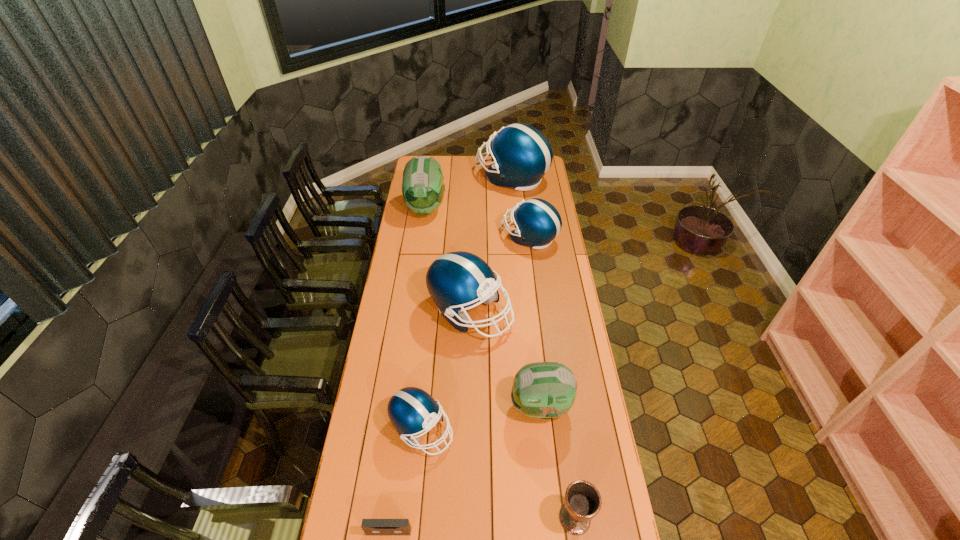
Locate an element on the screen. The image size is (960, 540). the tallest object is located at coordinates (521, 155).

Image resolution: width=960 pixels, height=540 pixels. Find the location of `the tallest football helmet`. the tallest football helmet is located at coordinates (521, 155).

This screenshot has height=540, width=960. In order to click on the farther green football helmet in this screenshot , I will do `click(423, 190)`.

Where is `the left green football helmet`? the left green football helmet is located at coordinates (423, 190).

I want to click on the third farthest blue football helmet, so click(x=455, y=280).

This screenshot has width=960, height=540. What are the coordinates of `the fourth farthest object` in the screenshot? It's located at (455, 280).

Where is `the third biggest blue football helmet`? This screenshot has width=960, height=540. the third biggest blue football helmet is located at coordinates (537, 222).

Image resolution: width=960 pixels, height=540 pixels. Find the location of `the right green football helmet`. the right green football helmet is located at coordinates (546, 390).

The width and height of the screenshot is (960, 540). In order to click on the nearer green football helmet in this screenshot , I will do `click(546, 390)`.

You are a GUI agent. You are given a task and a screenshot of the screen. Output one action in this format:
    pyautogui.click(x=<x>, y=<y>)
    Task: Click on the smallest blue football helmet
    This screenshot has width=960, height=540.
    Given the screenshot: What is the action you would take?
    pyautogui.click(x=411, y=410)